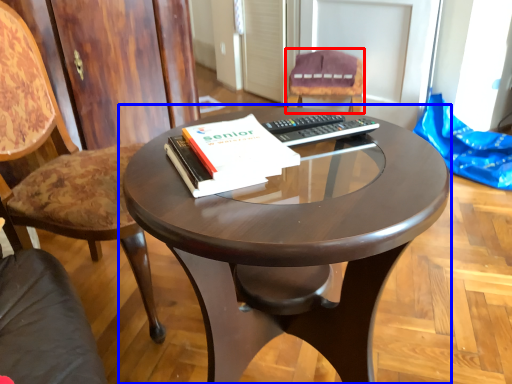
Question: Among these objects, which one is nearest to the camera, chair (highlighted by a red box) or coffee table (highlighted by a blue box)?

Choices:
 (A) chair
 (B) coffee table

Answer: (B)